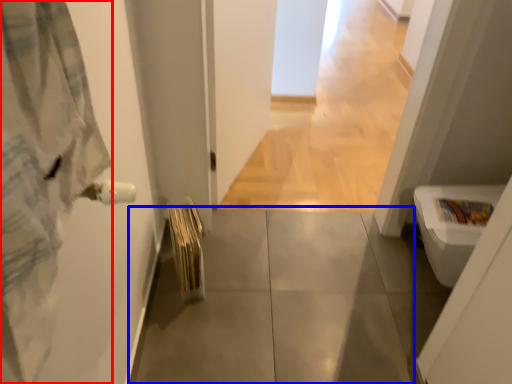
Question: Which point is further to the camera, bathrobe (highlighted by a red box) or concrete (highlighted by a blue box)?

Choices:
 (A) bathrobe
 (B) concrete

Answer: (B)